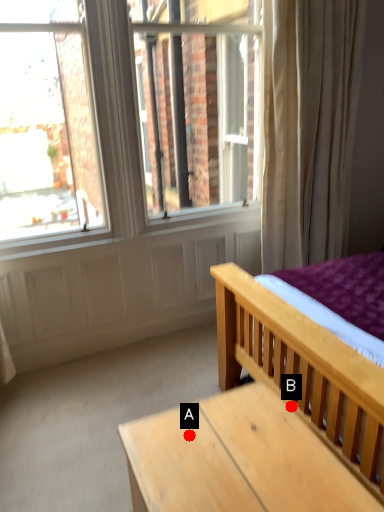
Question: Two points are circled on the image, labeled by A and B beside each circle. Which point is closer to the camera taking this photo?

Choices:
 (A) A is closer
 (B) B is closer

Answer: (A)